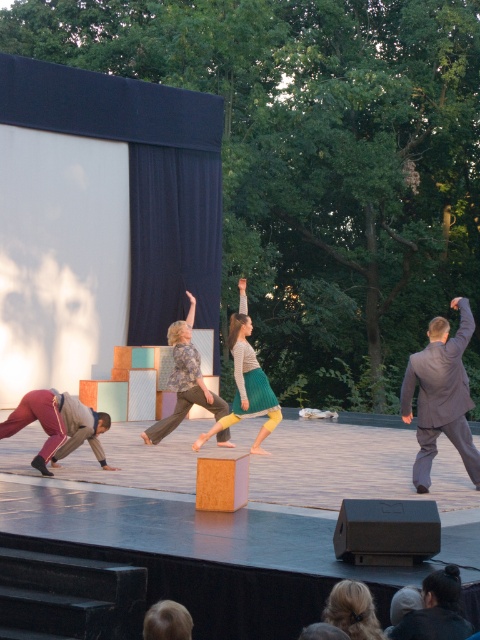
Question: Considering the real-world distances, which object is farthest from the patterned fabric pants at center?

Choices:
 (A) blonde hair at lower center
 (B) dark gray suit at right

Answer: (A)

Question: Does maroon fabric pants at left have a greater width compared to patterned fabric pants at center?

Choices:
 (A) yes
 (B) no

Answer: (A)

Question: Estimate the real-world distances between objects in this image. Which object is farther from the dark gray suit at right?

Choices:
 (A) patterned fabric pants at center
 (B) maroon fabric pants at left
 (C) dark gray knit hat at lower right
 (D) knitted sweater at center

Answer: (C)

Question: Which of these objects is positioned farthest from the blonde hair at lower center?

Choices:
 (A) patterned fabric pants at center
 (B) dark gray suit at right
 (C) maroon fabric pants at left

Answer: (A)

Question: Is knitted sweater at center below patterned fabric pants at center?

Choices:
 (A) no
 (B) yes

Answer: (A)

Question: Does knitted sweater at center appear on the right side of dark gray knit hat at lower right?

Choices:
 (A) yes
 (B) no

Answer: (B)